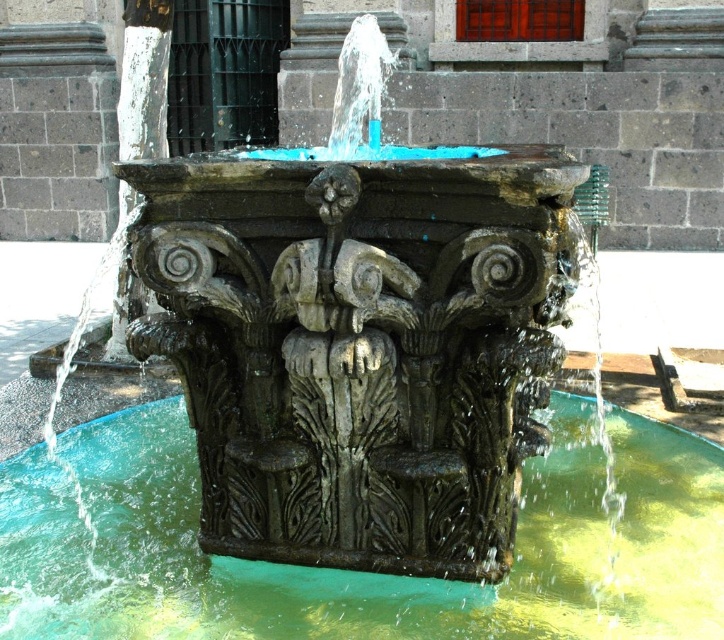
Is green polished water at center taller than carved stone figure at center?

In fact, green polished water at center may be shorter than carved stone figure at center.

Who is positioned more to the left, green polished water at center or carved stone figure at center?

From the viewer's perspective, carved stone figure at center appears more on the left side.

Who is more forward, (557,616) or (362,428)?

Point (362,428) is in front.

Identify the location of green polished water at center. The width and height of the screenshot is (724, 640). (362, 572).